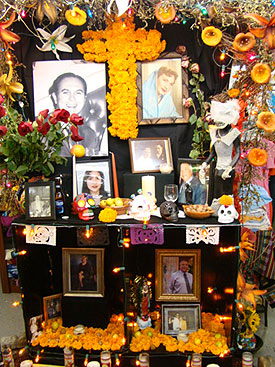
In order to click on flower garland in this screenshot , I will do `click(114, 345)`.